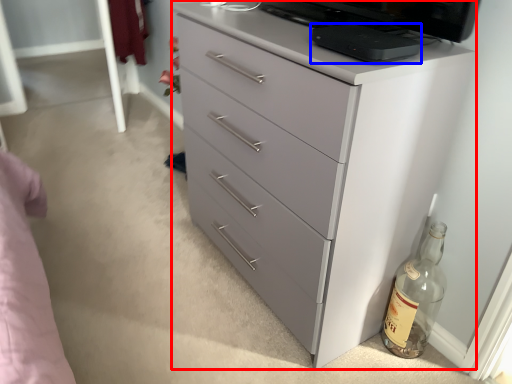
Question: Among these objects, which one is nearest to the camera, chest of drawers (highlighted by a red box) or appliance (highlighted by a blue box)?

Choices:
 (A) chest of drawers
 (B) appliance

Answer: (A)